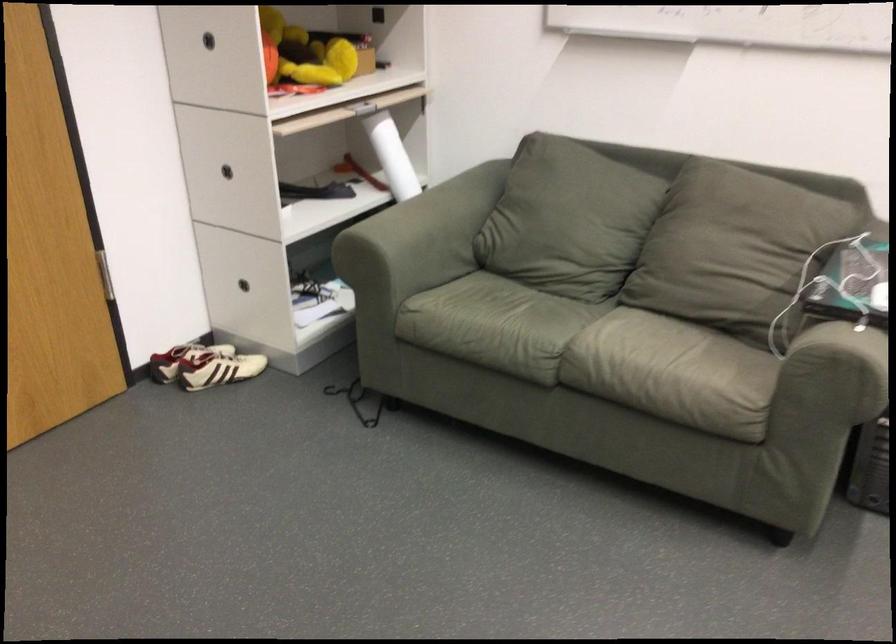
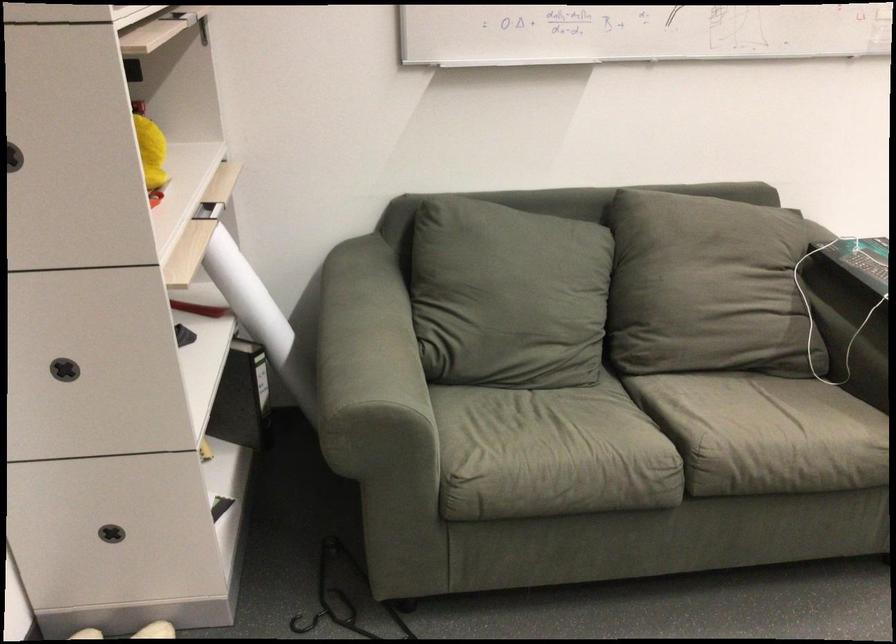
Locate, in the second image, the point that corresponds to (550,214) in the first image.

(506, 295)